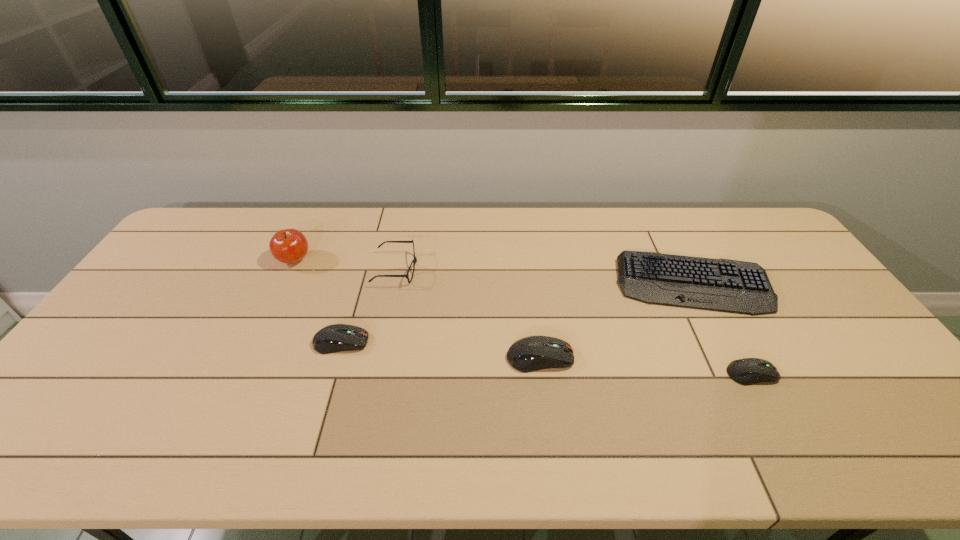
Locate an element on the screen. This screenshot has width=960, height=540. the fifth closest object to the spectacles is located at coordinates (747, 371).

This screenshot has width=960, height=540. What are the coordinates of `computer equipment that can be found as the closest to the second tallest computer equipment` in the screenshot? It's located at (532, 353).

Identify which computer equipment is the nearest to the second shortest computer equipment. Please provide its 2D coordinates. Your answer should be formatted as a tuple, i.e. [(x, y)], where the tuple contains the x and y coordinates of a point satisfying the conditions above.

[(532, 353)]

Image resolution: width=960 pixels, height=540 pixels. In order to click on vacant area in the image that satisfies the following two spatial constraints: 1. on the front-facing side of the spectacles; 2. on the back side of the computer keyboard in this screenshot , I will do `click(394, 284)`.